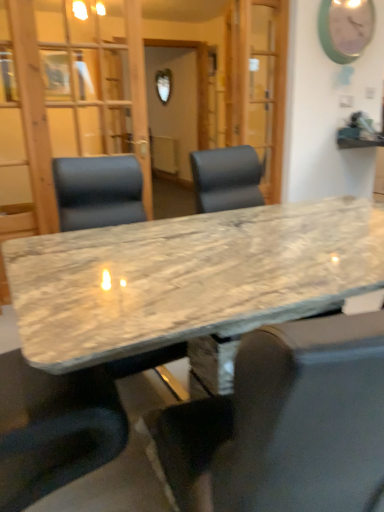
Question: Should I look upward or downward to see marble table at center?

Choices:
 (A) up
 (B) down

Answer: (B)

Question: Is transparent glass door at center to the right of matte green clock at upper right from the viewer's perspective?

Choices:
 (A) no
 (B) yes

Answer: (A)

Question: From the image's perspective, would you say transparent glass door at center is shown under matte green clock at upper right?

Choices:
 (A) no
 (B) yes

Answer: (B)

Question: Is the position of transparent glass door at center more distant than that of matte green clock at upper right?

Choices:
 (A) no
 (B) yes

Answer: (A)

Question: Is transparent glass door at center wider than matte green clock at upper right?

Choices:
 (A) no
 (B) yes

Answer: (B)

Question: From a real-world perspective, is transparent glass door at center beneath matte green clock at upper right?

Choices:
 (A) yes
 (B) no

Answer: (A)

Question: Is transparent glass door at center positioned beyond the bounds of matte green clock at upper right?

Choices:
 (A) no
 (B) yes

Answer: (B)

Question: Considering the relative positions of transparent glass door at center and leather-like black chair at center, acting as the second chair starting from the right, in the image provided, is transparent glass door at center to the left of leather-like black chair at center, acting as the second chair starting from the right, from the viewer's perspective?

Choices:
 (A) yes
 (B) no

Answer: (B)

Question: Considering the relative sizes of transparent glass door at center and leather-like black chair at center, which is counted as the first chair, starting from the back, in the image provided, is transparent glass door at center shorter than leather-like black chair at center, which is counted as the first chair, starting from the back,?

Choices:
 (A) yes
 (B) no

Answer: (B)

Question: Does transparent glass door at center have a lesser width compared to leather-like black chair at center, acting as the second chair starting from the right?

Choices:
 (A) yes
 (B) no

Answer: (A)

Question: Is transparent glass door at center located outside leather-like black chair at center, which is counted as the first chair, starting from the back?

Choices:
 (A) yes
 (B) no

Answer: (A)

Question: Is the depth of transparent glass door at center less than that of leather-like black chair at center, the 1th chair positioned from the left?

Choices:
 (A) yes
 (B) no

Answer: (B)

Question: Is leather-like black chair at center, which is counted as the first chair, starting from the back, at the back of transparent glass door at center?

Choices:
 (A) no
 (B) yes

Answer: (A)

Question: Is marble table at center outside of leather-like black chair at center, arranged as the second chair when viewed from the front?

Choices:
 (A) yes
 (B) no

Answer: (A)